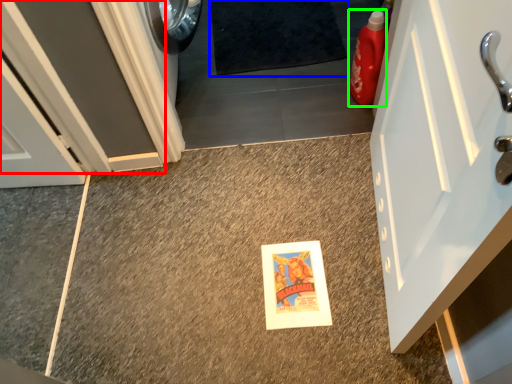
Question: Estimate the real-world distances between objects in this image. Which object is closer to door (highlighted by a red box), bath mat (highlighted by a blue box) or cleaning product (highlighted by a green box)?

Choices:
 (A) bath mat
 (B) cleaning product

Answer: (A)